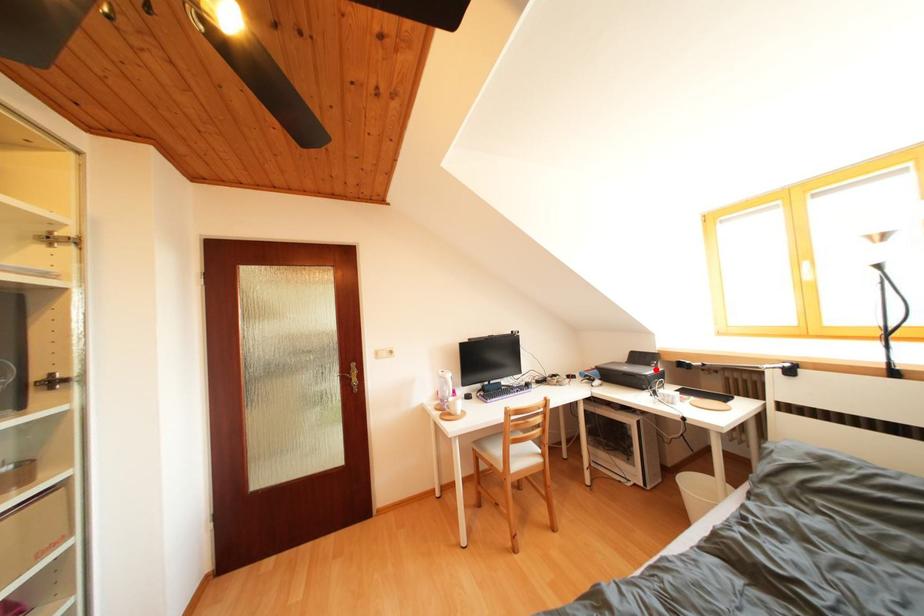
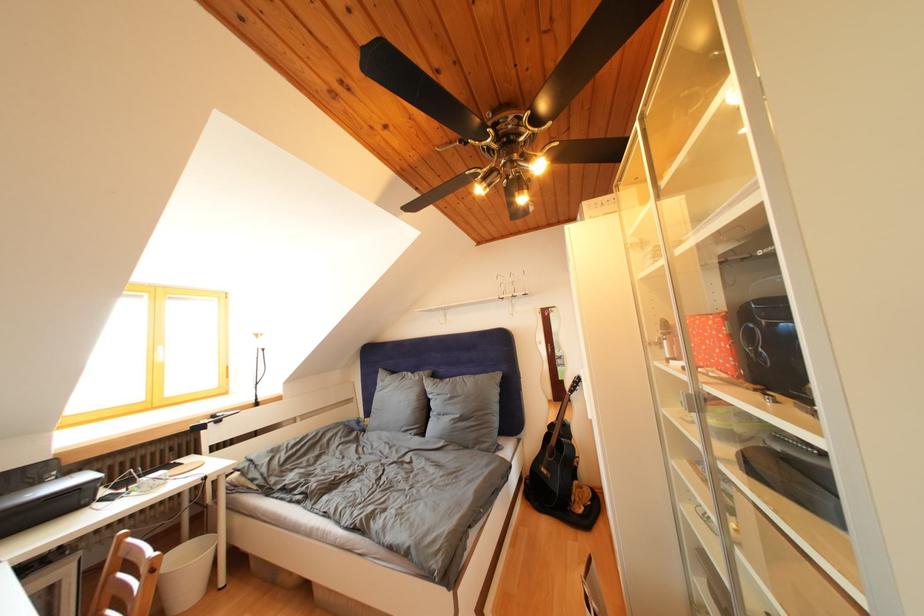
The point at the highlighted location is marked in the first image. Where is the corresponding point in the second image?

(44, 488)